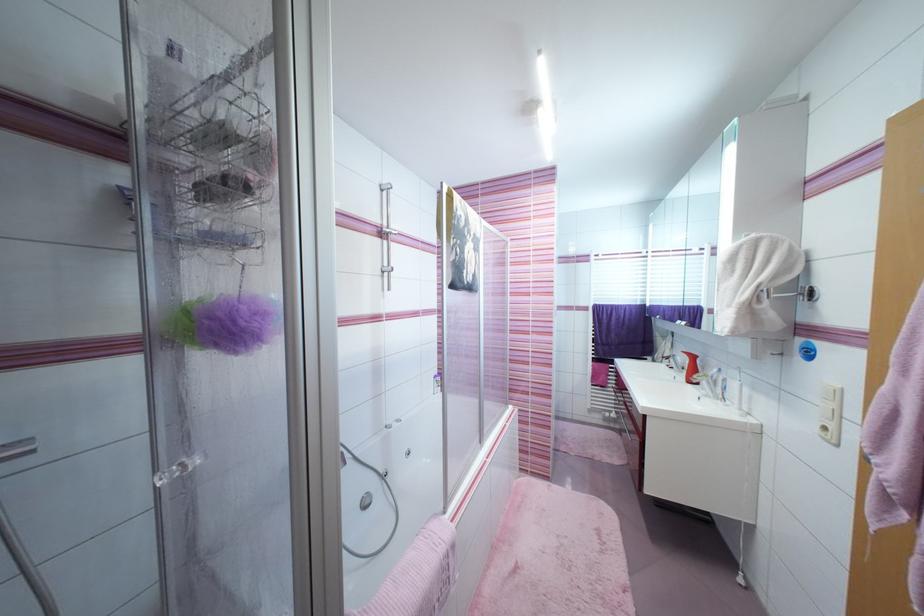
Describe the element at coordinates (704, 383) in the screenshot. Image resolution: width=924 pixels, height=616 pixels. I see `the sink faucet handle` at that location.